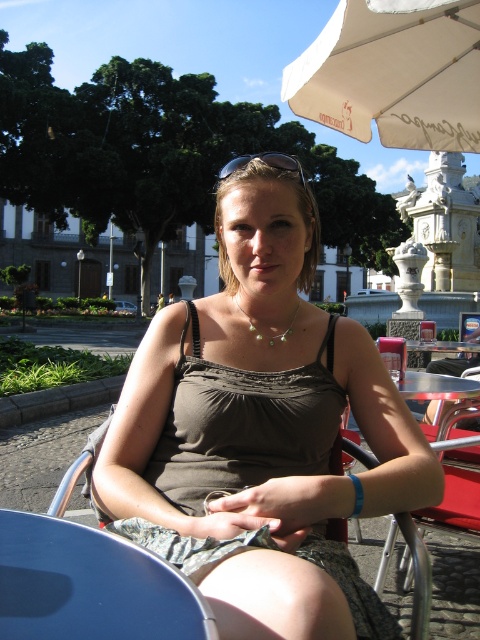
You are a fashion designer observing a model wearing a matte brown tank top at center and sunglasses at center. Which item is located to the right of the other?

The matte brown tank top at center is positioned on the right side of sunglasses at center.

You are a fashion designer observing a woman wearing a matte brown tank top at center and a pearl necklace at center. Which clothing item is positioned lower on her body?

The matte brown tank top at center is located below the pearl necklace at center, so the matte brown tank top at center is positioned lower on her body.